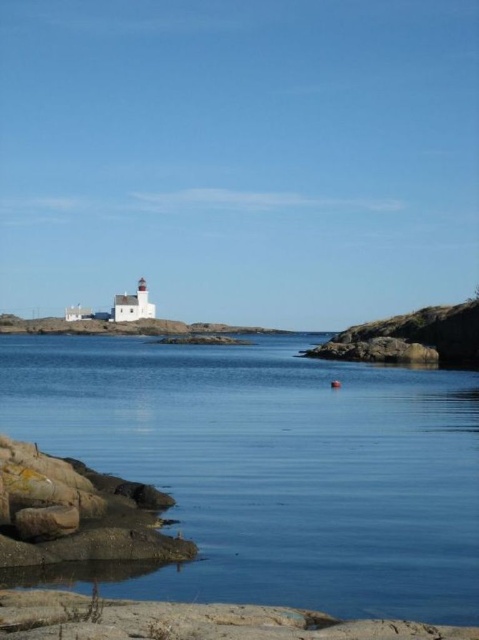
Question: Can you confirm if blue smooth water at center is positioned above rusty stone rocks at lower left?

Choices:
 (A) no
 (B) yes

Answer: (B)

Question: Is blue smooth water at center bigger than rusty stone rocks at lower left?

Choices:
 (A) no
 (B) yes

Answer: (B)

Question: Which object is farther from the camera taking this photo?

Choices:
 (A) rusty stone rocks at lower left
 (B) blue smooth water at center

Answer: (A)

Question: Does blue smooth water at center come in front of rusty stone rocks at lower left?

Choices:
 (A) yes
 (B) no

Answer: (A)